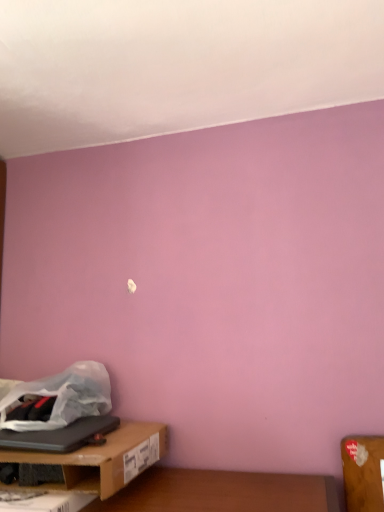
Question: Would you say brown cardboard box at lower left contains translucent white plastic bag at lower left?

Choices:
 (A) no
 (B) yes

Answer: (A)

Question: Is brown cardboard box at lower left shorter than translucent white plastic bag at lower left?

Choices:
 (A) no
 (B) yes

Answer: (B)

Question: Considering the relative sizes of brown cardboard box at lower left and translucent white plastic bag at lower left in the image provided, is brown cardboard box at lower left taller than translucent white plastic bag at lower left?

Choices:
 (A) yes
 (B) no

Answer: (B)

Question: From the image's perspective, is brown cardboard box at lower left below translucent white plastic bag at lower left?

Choices:
 (A) no
 (B) yes

Answer: (B)

Question: Is brown cardboard box at lower left bigger than translucent white plastic bag at lower left?

Choices:
 (A) yes
 (B) no

Answer: (A)

Question: Is brown cardboard box at lower left taller or shorter than black matte laptop at lower left?

Choices:
 (A) short
 (B) tall

Answer: (B)

Question: Is brown cardboard box at lower left situated inside black matte laptop at lower left or outside?

Choices:
 (A) outside
 (B) inside

Answer: (A)

Question: Does point (54, 458) appear closer or farther from the camera than point (54, 438)?

Choices:
 (A) farther
 (B) closer

Answer: (B)

Question: From the image's perspective, is brown cardboard box at lower left positioned above or below black matte laptop at lower left?

Choices:
 (A) above
 (B) below

Answer: (B)

Question: Relative to brown cardboard box at lower left, is translucent white plastic bag at lower left in front or behind?

Choices:
 (A) behind
 (B) front

Answer: (A)

Question: From the image's perspective, is translucent white plastic bag at lower left located above or below brown cardboard box at lower left?

Choices:
 (A) below
 (B) above

Answer: (B)

Question: Looking at the image, does translucent white plastic bag at lower left seem bigger or smaller compared to brown cardboard box at lower left?

Choices:
 (A) big
 (B) small

Answer: (B)

Question: Looking at their shapes, would you say translucent white plastic bag at lower left is wider or thinner than brown cardboard box at lower left?

Choices:
 (A) thin
 (B) wide

Answer: (A)

Question: In terms of height, does black matte laptop at lower left look taller or shorter compared to brown cardboard box at lower left?

Choices:
 (A) tall
 (B) short

Answer: (B)

Question: Considering the positions of point (51, 443) and point (107, 446), is point (51, 443) closer or farther from the camera than point (107, 446)?

Choices:
 (A) farther
 (B) closer

Answer: (A)